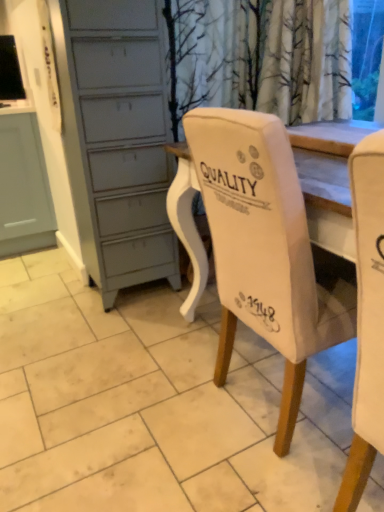
Where is `vacant area situated below white fabric chair at center (from a real-world perspective)`? vacant area situated below white fabric chair at center (from a real-world perspective) is located at coordinates (276, 399).